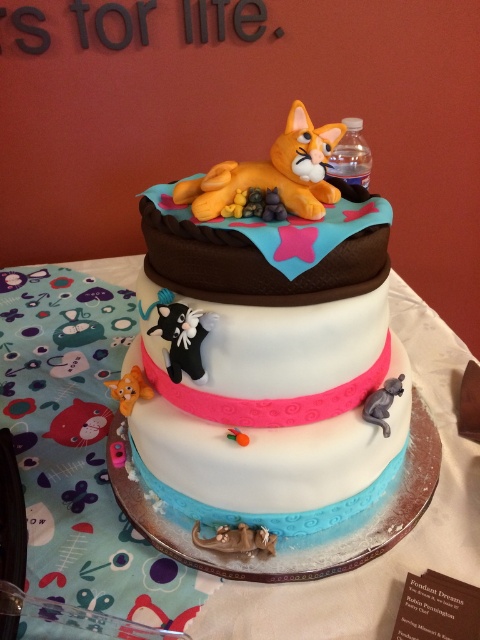
Question: Among these points, which one is farthest from the camera?

Choices:
 (A) (177, 337)
 (B) (300, 189)
 (C) (386, 396)

Answer: (B)

Question: Observing the image, what is the correct spatial positioning of matte white cake at center in reference to white fabric tablecloth at center?

Choices:
 (A) below
 (B) above

Answer: (B)

Question: Is matte white cake at center to the left of matte gray cat at lower right from the viewer's perspective?

Choices:
 (A) yes
 (B) no

Answer: (A)

Question: Which point appears farthest from the camera in this image?

Choices:
 (A) (373, 406)
 (B) (106, 273)
 (C) (216, 168)
 (D) (165, 321)

Answer: (B)

Question: From the image, what is the correct spatial relationship of white fabric tablecloth at center in relation to black plush cat at center?

Choices:
 (A) right
 (B) left

Answer: (A)

Question: Which of the following is the closest to the observer?

Choices:
 (A) (80, 400)
 (B) (292, 140)
 (C) (384, 404)
 (D) (201, 321)

Answer: (D)